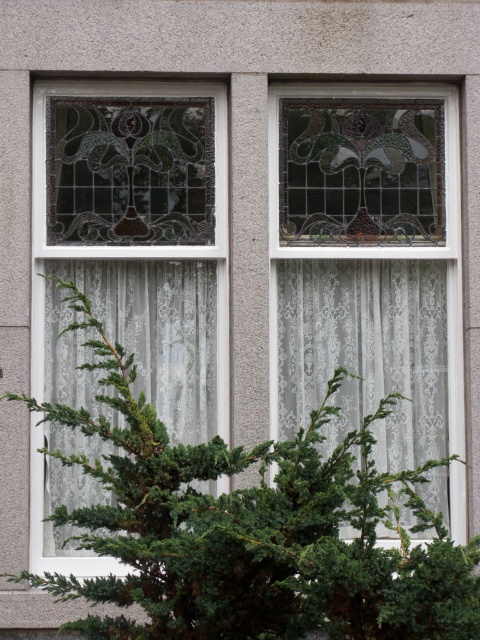
Question: Observing the image, what is the correct spatial positioning of green leafy bush at center in reference to white lace curtain at center?

Choices:
 (A) below
 (B) above

Answer: (A)

Question: Which object appears farthest from the camera in this image?

Choices:
 (A) white lace curtain at center
 (B) green leafy bush at center
 (C) white lace curtain at left

Answer: (A)

Question: Which point is farther to the camera?

Choices:
 (A) white lace curtain at left
 (B) white lace curtain at center

Answer: (B)

Question: Is white lace curtain at center bigger than white lace curtain at left?

Choices:
 (A) no
 (B) yes

Answer: (A)

Question: Which of the following is the closest to the observer?

Choices:
 (A) (60, 392)
 (B) (447, 484)
 (C) (165, 547)

Answer: (C)

Question: Is white lace curtain at center further to the viewer compared to white lace curtain at left?

Choices:
 (A) yes
 (B) no

Answer: (A)